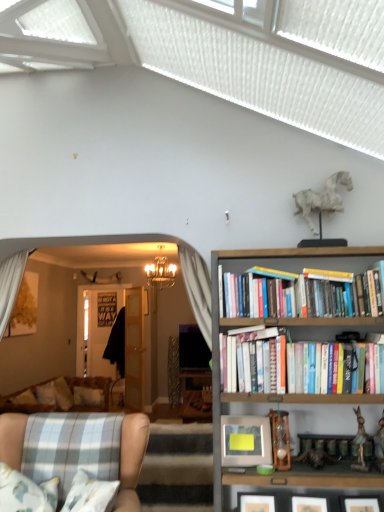
The image size is (384, 512). In order to click on plaid fabric armchair at lower left in this screenshot , I will do `click(132, 460)`.

What is the approximate height of crystal chandelier at center?

crystal chandelier at center is 55.92 centimeters tall.

At what (x,y) coordinates should I click in order to perform the action: click on plaid fabric armchair at lower left. Please return your answer as a coordinate pair (x, y). This screenshot has width=384, height=512. Looking at the image, I should click on (132, 460).

In the scene shown: From the image's perspective, relative to metallic silver picture frame at right, is wooden bookshelf at upper right above or below?

From the image's perspective, wooden bookshelf at upper right appears above metallic silver picture frame at right.

Which object is positioned more to the left, wooden bookshelf at upper right or metallic silver picture frame at right?

From the viewer's perspective, metallic silver picture frame at right appears more on the left side.

Does wooden bookshelf at upper right come in front of metallic silver picture frame at right?

Yes, it is in front of metallic silver picture frame at right.

Where is `bookcase above the metallic silver picture frame at right (from the image's perspective)`? bookcase above the metallic silver picture frame at right (from the image's perspective) is located at coordinates (275, 393).

Consider the image. Considering the relative sizes of metallic silver picture frame at right and wooden bookshelf at upper right in the image provided, is metallic silver picture frame at right wider than wooden bookshelf at upper right?

No, metallic silver picture frame at right is not wider than wooden bookshelf at upper right.

Is point (253, 444) positioned before point (296, 334)?

Yes, point (253, 444) is closer to viewer.

From a real-world perspective, which object rests below the other?

plaid fabric armchair at lower left, from a real-world perspective.

Which of these two, metallic silver picture frame at right or plaid fabric armchair at lower left, is bigger?

plaid fabric armchair at lower left is bigger.

Is metallic silver picture frame at right positioned in front of plaid fabric armchair at lower left?

No, metallic silver picture frame at right is further to the viewer.

Is metallic silver picture frame at right touching plaid fabric armchair at lower left?

There is a gap between metallic silver picture frame at right and plaid fabric armchair at lower left.

In the scene shown: From a real-world perspective, is crystal chandelier at center on wooden bookshelf at upper right?

Yes, from a real-world perspective, crystal chandelier at center is over wooden bookshelf at upper right

Considering the relative sizes of crystal chandelier at center and wooden bookshelf at upper right in the image provided, is crystal chandelier at center thinner than wooden bookshelf at upper right?

No, crystal chandelier at center is not thinner than wooden bookshelf at upper right.

Is crystal chandelier at center not near wooden bookshelf at upper right?

Indeed, crystal chandelier at center is not near wooden bookshelf at upper right.

Between crystal chandelier at center and wooden bookshelf at upper right, which one is positioned in front?

Positioned in front is wooden bookshelf at upper right.

The width and height of the screenshot is (384, 512). I want to click on lamp that is behind the plaid fabric armchair at lower left, so click(x=160, y=273).

From a real-world perspective, which is physically above, crystal chandelier at center or plaid fabric armchair at lower left?

crystal chandelier at center.

Considering the positions of objects crystal chandelier at center and plaid fabric armchair at lower left in the image provided, who is in front, crystal chandelier at center or plaid fabric armchair at lower left?

plaid fabric armchair at lower left is closer to the camera.

From a real-world perspective, is wooden bookshelf at upper right below crystal chandelier at center?

Yes, from a real-world perspective, wooden bookshelf at upper right is under crystal chandelier at center.

Consider the image. Considering the sizes of objects wooden bookshelf at upper right and crystal chandelier at center in the image provided, who is thinner, wooden bookshelf at upper right or crystal chandelier at center?

With smaller width is wooden bookshelf at upper right.

From the image's perspective, does wooden bookshelf at upper right appear lower than crystal chandelier at center?

Indeed, from the image's perspective, wooden bookshelf at upper right is shown beneath crystal chandelier at center.

Is point (117, 510) closer to camera compared to point (159, 257)?

Yes, it is.

Is plaid fabric armchair at lower left positioned with its back to crystal chandelier at center?

No, plaid fabric armchair at lower left is not facing the opposite direction of crystal chandelier at center.

Is plaid fabric armchair at lower left further to the viewer compared to crystal chandelier at center?

No, the depth of plaid fabric armchair at lower left is less than that of crystal chandelier at center.

In order to click on bookcase that appears above the metallic silver picture frame at right (from a real-world perspective) in this screenshot , I will do `click(275, 393)`.

The height and width of the screenshot is (512, 384). I want to click on bookcase in front of the metallic silver picture frame at right, so click(x=275, y=393).

From the image, which object appears to be farther from plaid fabric armchair at lower left, metallic silver picture frame at right or wooden bookshelf at upper right?

Among the two, wooden bookshelf at upper right is located further to plaid fabric armchair at lower left.

Based on their spatial positions, is plaid fabric armchair at lower left or crystal chandelier at center closer to wooden bookshelf at upper right?

The object closer to wooden bookshelf at upper right is plaid fabric armchair at lower left.

Based on their spatial positions, is plaid fabric armchair at lower left or metallic silver picture frame at right further from wooden bookshelf at upper right?

plaid fabric armchair at lower left is positioned further to the anchor wooden bookshelf at upper right.

Based on their spatial positions, is crystal chandelier at center or wooden bookshelf at upper right further from plaid fabric armchair at lower left?

Among the two, crystal chandelier at center is located further to plaid fabric armchair at lower left.

Which object lies nearer to the anchor point metallic silver picture frame at right, wooden bookshelf at upper right or crystal chandelier at center?

wooden bookshelf at upper right is positioned closer to the anchor metallic silver picture frame at right.

When comparing their distances from metallic silver picture frame at right, does wooden bookshelf at upper right or plaid fabric armchair at lower left seem further?

Among the two, plaid fabric armchair at lower left is located further to metallic silver picture frame at right.

When comparing their distances from plaid fabric armchair at lower left, does metallic silver picture frame at right or crystal chandelier at center seem further?

crystal chandelier at center is further to plaid fabric armchair at lower left.

From the image, which object appears to be farther from wooden bookshelf at upper right, crystal chandelier at center or plaid fabric armchair at lower left?

crystal chandelier at center lies further to wooden bookshelf at upper right than the other object.

I want to click on picture frame between plaid fabric armchair at lower left and wooden bookshelf at upper right in the horizontal direction, so click(245, 441).

The height and width of the screenshot is (512, 384). Identify the location of picture frame between wooden bookshelf at upper right and crystal chandelier at center along the z-axis. (245, 441).

In order to click on bookcase between plaid fabric armchair at lower left and crystal chandelier at center from front to back in this screenshot , I will do `click(275, 393)`.

The image size is (384, 512). I want to click on picture frame positioned between plaid fabric armchair at lower left and crystal chandelier at center from near to far, so click(245, 441).